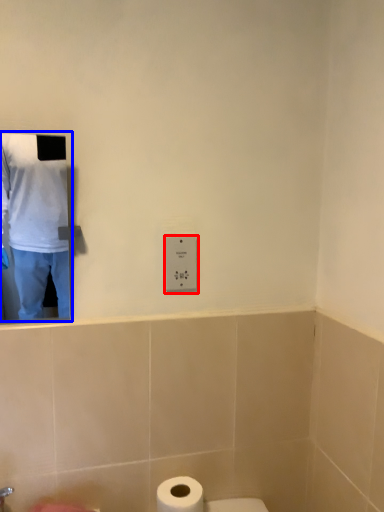
Question: Which of the following is the farthest to the observer, electric outlet (highlighted by a red box) or man (highlighted by a blue box)?

Choices:
 (A) electric outlet
 (B) man

Answer: (A)